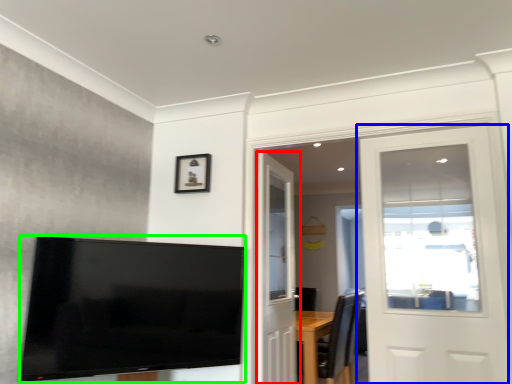
Question: Estimate the real-world distances between objects in this image. Which object is closer to door (highlighted by a red box), door (highlighted by a blue box) or television (highlighted by a green box)?

Choices:
 (A) door
 (B) television

Answer: (B)